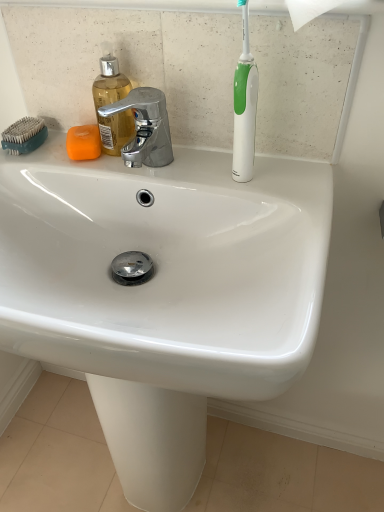
Locate an element on the screen. This screenshot has height=512, width=384. vacant region to the right of white glossy toothbrush at upper right is located at coordinates (299, 175).